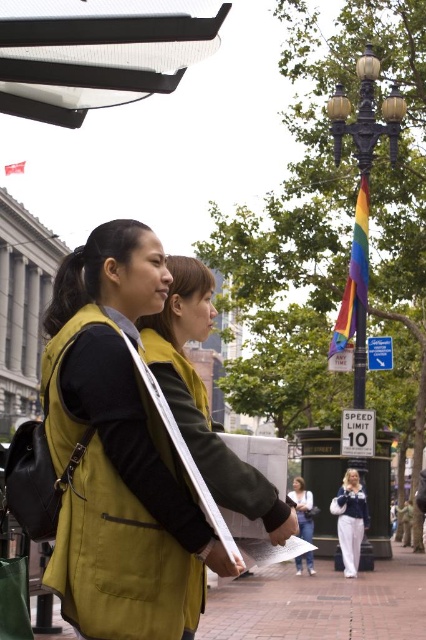
You are a tailor measuring garments for alteration. You have a sewing machine that can handle fabrics up to 40 cm in width. You need to alter both the matte yellow vest at center and the white matte jacket at center. Based on the image, can you determine which garment requires immediate attention to ensure it fits through the sewing machine?

The matte yellow vest at center is wider than the white matte jacket at center. Since the sewing machine can handle up to 40 cm, the matte yellow vest at center must be checked first to ensure its width is within the machine capacity.

Looking at this image, you are a fashion designer analyzing the image. You need to determine which item of clothing is taller between the matte yellow vest at center and the white matte jacket at center. Which one is taller?

The matte yellow vest at center is taller than the white matte jacket at center according to the description.